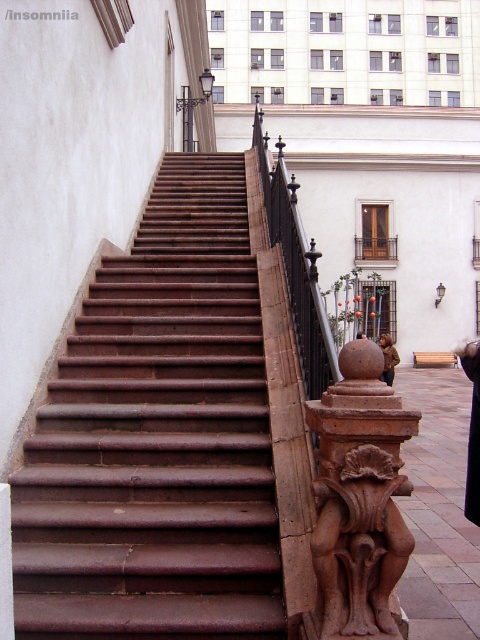
Question: Is brown stone stairs at center thinner than black wrought iron railing at upper center?

Choices:
 (A) no
 (B) yes

Answer: (B)

Question: Is brown stone stairs at center further to camera compared to black wrought iron railing at upper center?

Choices:
 (A) no
 (B) yes

Answer: (A)

Question: Does brown stone stairs at center lie in front of brown stone carving at center?

Choices:
 (A) yes
 (B) no

Answer: (B)

Question: Which object is positioned farthest from the brown stone carving at center?

Choices:
 (A) black wrought iron railing at upper center
 (B) brown stone stairs at center

Answer: (A)

Question: Among these objects, which one is farthest from the camera?

Choices:
 (A) brown stone stairs at center
 (B) black wrought iron railing at upper center
 (C) brown stone carving at center

Answer: (B)

Question: Which point appears farthest from the camera in this image?

Choices:
 (A) pos(157,353)
 (B) pos(321,563)
 (C) pos(310,392)

Answer: (A)